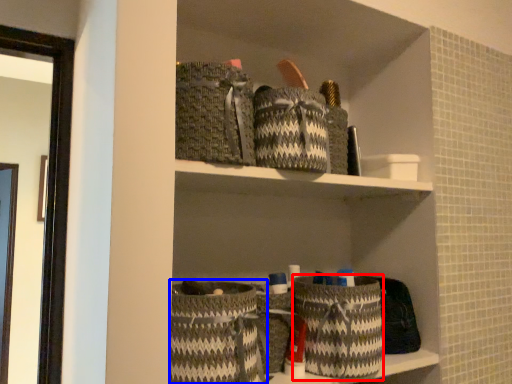
Question: Which of the following is the farthest to the observer, basket (highlighted by a red box) or basket (highlighted by a blue box)?

Choices:
 (A) basket
 (B) basket

Answer: (A)